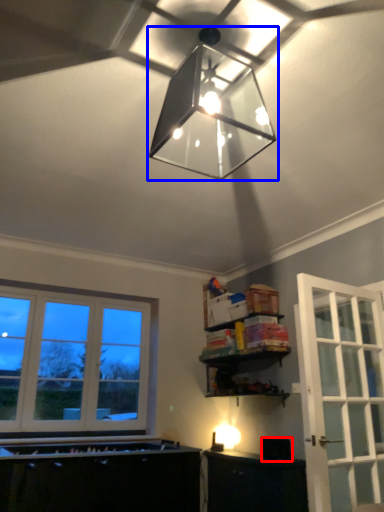
Question: Which object is further to the camera taking this photo, appliance (highlighted by a red box) or lamp (highlighted by a blue box)?

Choices:
 (A) appliance
 (B) lamp

Answer: (A)